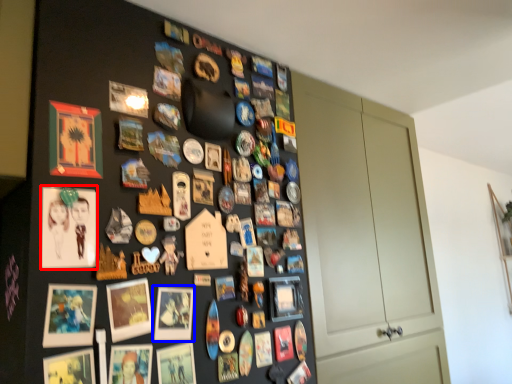
Question: Which object appears closest to the camera in this image, picture frame (highlighted by a red box) or picture frame (highlighted by a blue box)?

Choices:
 (A) picture frame
 (B) picture frame

Answer: (A)